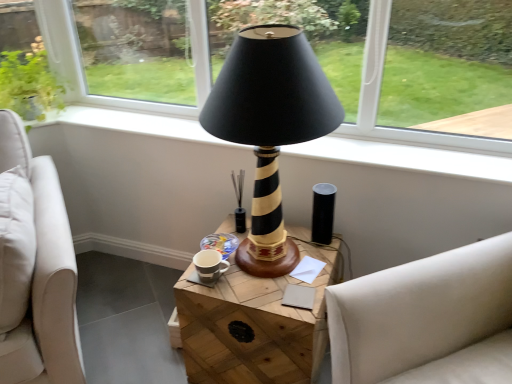
Identify the location of free space above wooden at center (from a real-world perspective). Image resolution: width=512 pixels, height=384 pixels. (276, 269).